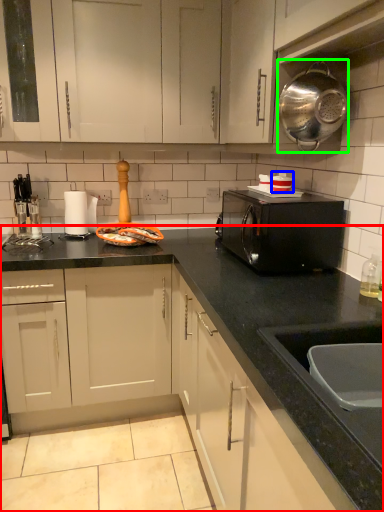
Question: Which is farther away from countertop (highlighted by a red box)? appliance (highlighted by a blue box) or kitchen appliance (highlighted by a green box)?

Choices:
 (A) appliance
 (B) kitchen appliance

Answer: (B)